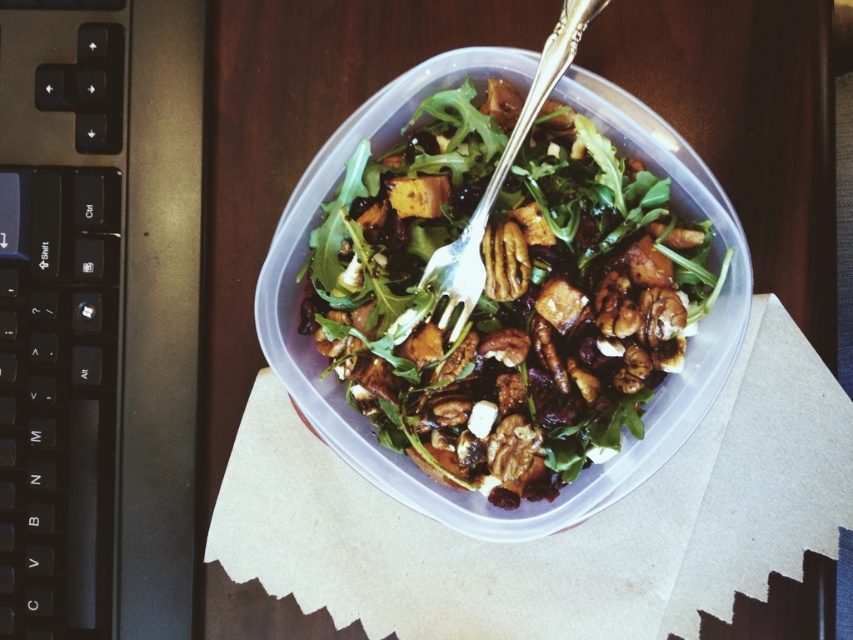
Question: Can you confirm if green leafymaterial/textureobject at upper center is positioned to the right of silver metallic fork at center?

Choices:
 (A) yes
 (B) no

Answer: (A)

Question: Does green leafymaterial/textureobject at upper center have a larger size compared to silver metallic fork at center?

Choices:
 (A) yes
 (B) no

Answer: (A)

Question: Is green leafymaterial/textureobject at upper center in front of silver metallic fork at center?

Choices:
 (A) yes
 (B) no

Answer: (B)

Question: Which point is closer to the camera?

Choices:
 (A) green leafymaterial/textureobject at upper center
 (B) silver metallic fork at center

Answer: (B)